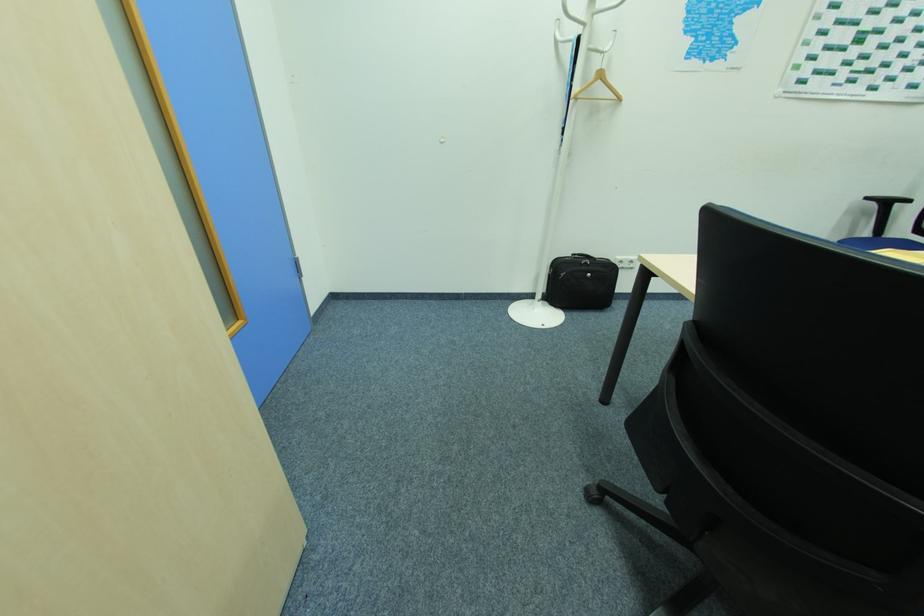
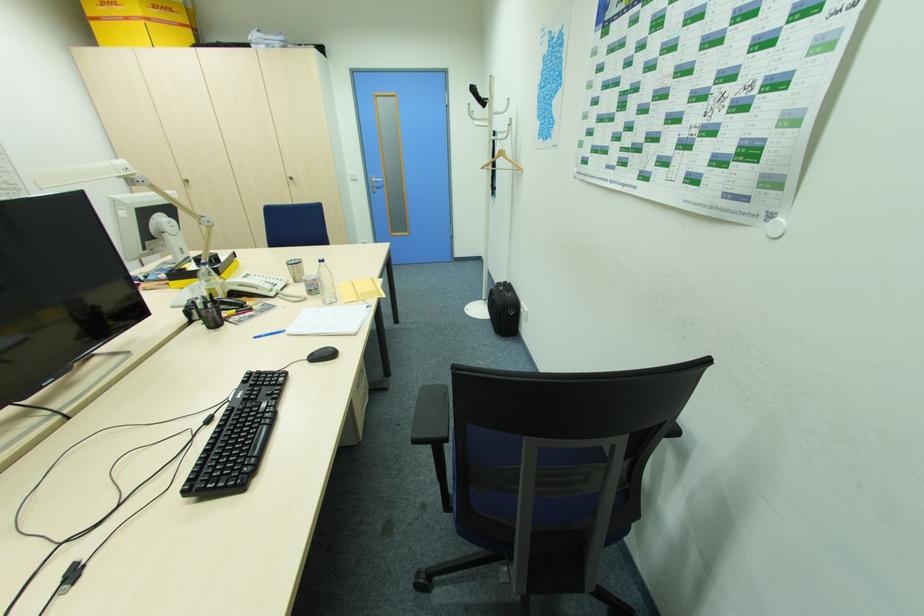
Where in the second image is the point corresponding to point 578,315 from the first image?

(492, 325)